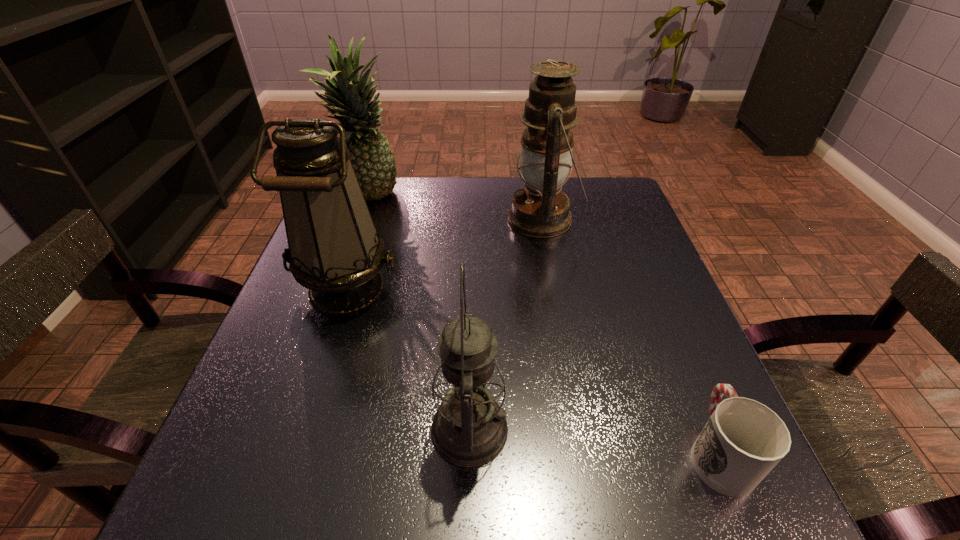
The width and height of the screenshot is (960, 540). What are the coordinates of `pineapple that is at the left edge` in the screenshot? It's located at (371, 155).

I want to click on oil lamp that is at the left edge, so click(334, 250).

Locate an element on the screen. lantern that is at the right edge is located at coordinates (541, 210).

Find the location of a particular element. cup at the right edge is located at coordinates (743, 440).

Locate an element on the screen. object situated at the far left corner is located at coordinates (371, 155).

Locate an element on the screen. This screenshot has height=540, width=960. object that is at the far right corner is located at coordinates (541, 210).

The height and width of the screenshot is (540, 960). I want to click on object that is at the near right corner, so click(743, 440).

I want to click on vacant space at the far edge, so click(434, 192).

Identify the location of vacant area at the left edge of the desktop. Image resolution: width=960 pixels, height=540 pixels. (259, 435).

Image resolution: width=960 pixels, height=540 pixels. In the image, there is a desktop. What are the coordinates of `vacant space at the right edge` in the screenshot? It's located at (702, 420).